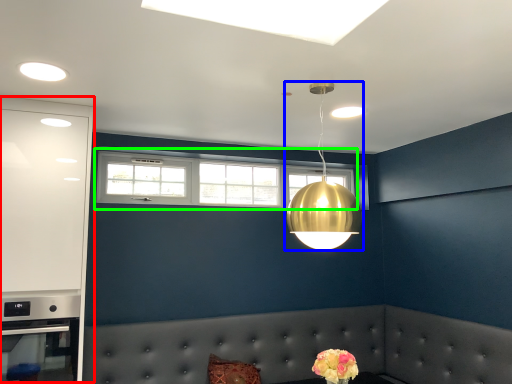
Question: Which is nearer to the dresser (highlighted by a red box)? lamp (highlighted by a blue box) or window (highlighted by a green box).

Choices:
 (A) lamp
 (B) window

Answer: (B)